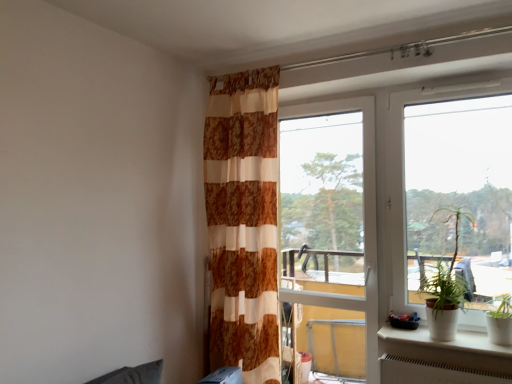
Question: Would you say transparent glass screen door at center is outside green leafy plant at right?

Choices:
 (A) yes
 (B) no

Answer: (A)

Question: Is green leafy plant at right a part of transparent glass screen door at center?

Choices:
 (A) no
 (B) yes

Answer: (A)

Question: Is transparent glass screen door at center positioned before green leafy plant at right?

Choices:
 (A) no
 (B) yes

Answer: (A)

Question: Does transparent glass screen door at center appear on the right side of green leafy plant at right?

Choices:
 (A) yes
 (B) no

Answer: (B)

Question: Is transparent glass screen door at center facing towards green leafy plant at right?

Choices:
 (A) yes
 (B) no

Answer: (B)

Question: Do you think white ceramic pot at lower right is within transparent glass window at right, or outside of it?

Choices:
 (A) inside
 (B) outside

Answer: (B)

Question: From a real-world perspective, is white ceramic pot at lower right positioned above or below transparent glass window at right?

Choices:
 (A) above
 (B) below

Answer: (B)

Question: Is white ceramic pot at lower right wider or thinner than transparent glass window at right?

Choices:
 (A) wide
 (B) thin

Answer: (A)

Question: Is white ceramic pot at lower right to the left or to the right of transparent glass window at right in the image?

Choices:
 (A) right
 (B) left

Answer: (B)

Question: Is brown textured curtain at center bigger or smaller than green leafy plant at right?

Choices:
 (A) big
 (B) small

Answer: (A)

Question: From the image's perspective, is brown textured curtain at center located above or below green leafy plant at right?

Choices:
 (A) below
 (B) above

Answer: (B)

Question: Considering their positions, is brown textured curtain at center located in front of or behind green leafy plant at right?

Choices:
 (A) behind
 (B) front

Answer: (A)

Question: Is brown textured curtain at center taller or shorter than green leafy plant at right?

Choices:
 (A) tall
 (B) short

Answer: (A)

Question: From a real-world perspective, relative to white ceramic pot at lower right, is brown textured curtain at center vertically above or below?

Choices:
 (A) below
 (B) above

Answer: (B)

Question: From the image's perspective, is brown textured curtain at center located above or below white ceramic pot at lower right?

Choices:
 (A) below
 (B) above

Answer: (B)